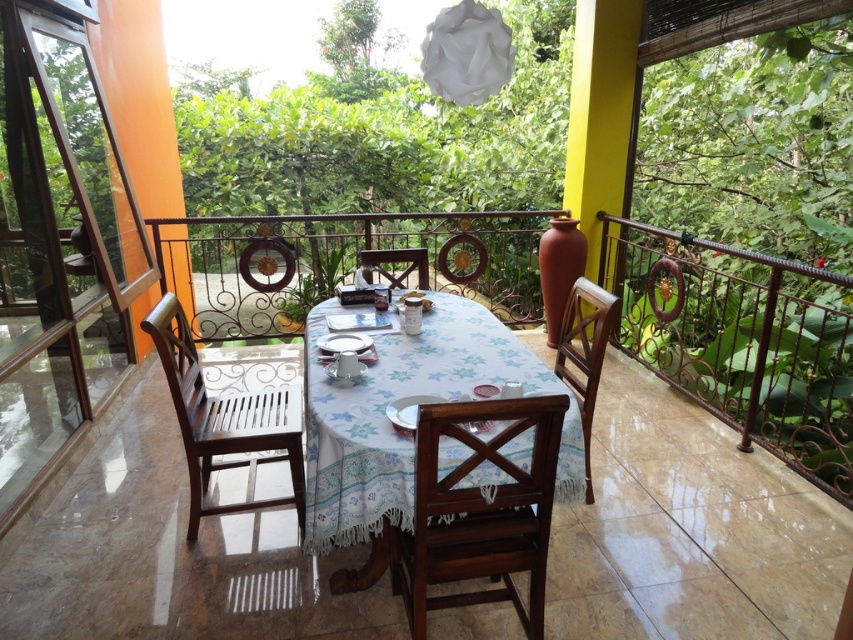
You are planning to host a dinner party on the balcony and need to seat guests comfortably. Given the space available, which chair between the brown wooden chair at left and the wooden chair at center would you choose for a guest who prefers more seating space?

The brown wooden chair at left is bigger than the wooden chair at center, so it would provide more seating space for guests who prefer a larger chair.

You are a guest staying in this balcony and want to sit down. Which chair, the mahogany wood chair at center or the wooden chair at right, is closer to the table?

The mahogany wood chair at center is closer to the table because it is positioned under the wooden chair at right, meaning it is directly beneath it and therefore nearer to the central table.

You are sitting on the wooden chair at right and want to move to the mahogany wood chair at center. Which direction should you move to reach it?

The mahogany wood chair at center is in front of the wooden chair at right, so you should move forward to reach it.